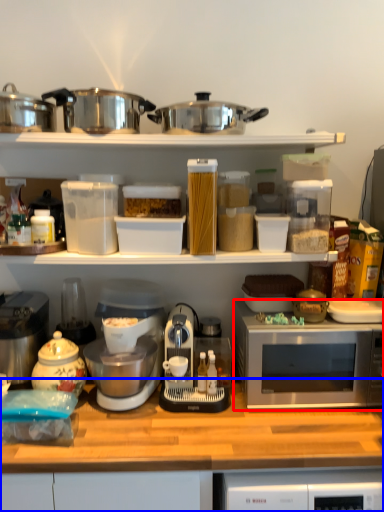
Question: Which of the following is the closest to the observer, microwave oven (highlighted by a red box) or countertop (highlighted by a blue box)?

Choices:
 (A) microwave oven
 (B) countertop

Answer: (B)